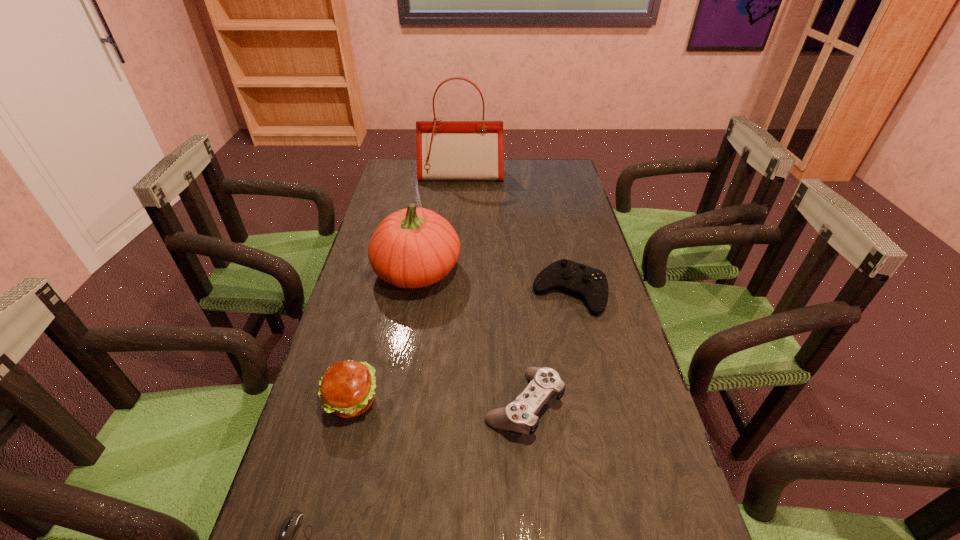
Locate an element on the screen. The height and width of the screenshot is (540, 960). free area in between the pumpkin and the farther control is located at coordinates (492, 281).

The height and width of the screenshot is (540, 960). Identify the location of free space between the farther control and the farthest object. (515, 234).

Where is `free space between the farther control and the farthest object`? free space between the farther control and the farthest object is located at coordinates (515, 234).

Identify which object is the third closest to the fourth shortest object. Please provide its 2D coordinates. Your answer should be formatted as a tuple, i.e. [(x, y)], where the tuple contains the x and y coordinates of a point satisfying the conditions above.

[(414, 247)]

Locate which object ranks in proximity to the third tallest object. Please provide its 2D coordinates. Your answer should be formatted as a tuple, i.e. [(x, y)], where the tuple contains the x and y coordinates of a point satisfying the conditions above.

[(287, 529)]

I want to click on vacant space that satisfies the following two spatial constraints: 1. on the front side of the handbag; 2. on the left side of the farther control, so (453, 292).